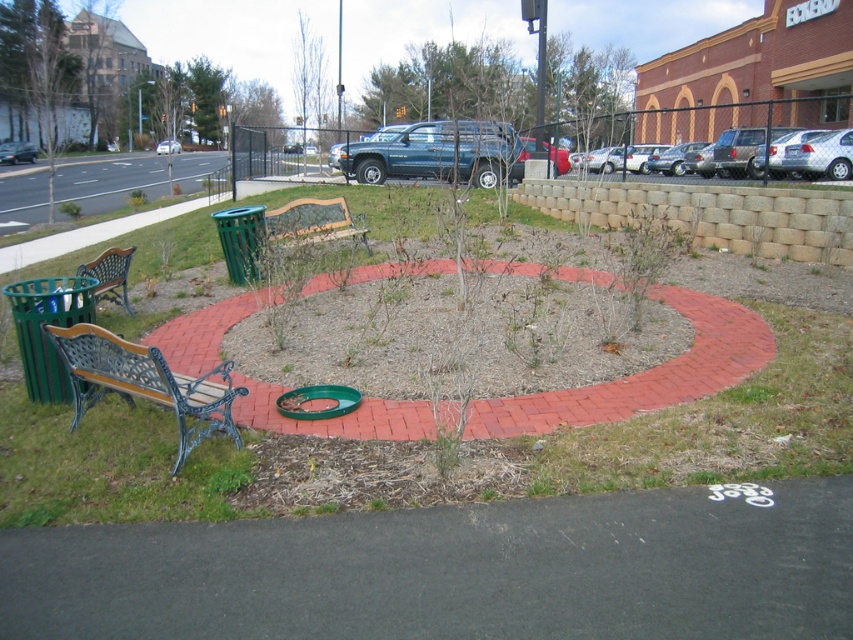
Question: Which point is closer to the camera taking this photo?

Choices:
 (A) (288, 401)
 (B) (277, 224)

Answer: (A)

Question: Which of the following is the farthest from the observer?

Choices:
 (A) green plastic circle at center
 (B) green grass at lower left
 (C) green metal bench at left

Answer: (C)

Question: Which point appears closest to the camera in this image?

Choices:
 (A) pos(123,365)
 (B) pos(113,252)
 (C) pos(281,410)
 (D) pos(338,234)

Answer: (A)

Question: Is green plastic circle at center smaller than green metal bench at left?

Choices:
 (A) yes
 (B) no

Answer: (A)

Question: Is green grass at lower left positioned in front of green metal bench at left?

Choices:
 (A) yes
 (B) no

Answer: (A)

Question: Considering the relative positions of green plastic circle at center and green metal bench at left in the image provided, where is green plastic circle at center located with respect to green metal bench at left?

Choices:
 (A) left
 (B) right

Answer: (B)